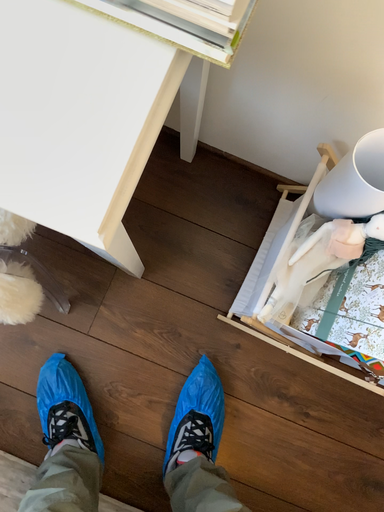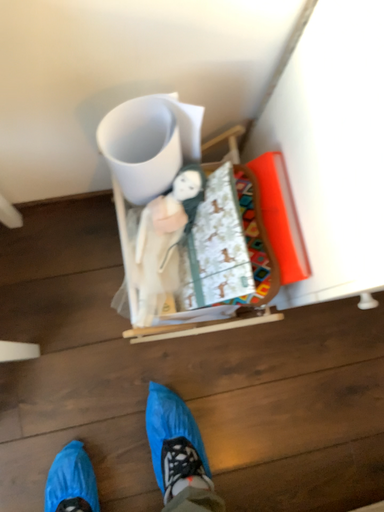
Question: Which way did the camera rotate in the video?

Choices:
 (A) rotated right
 (B) rotated left

Answer: (A)